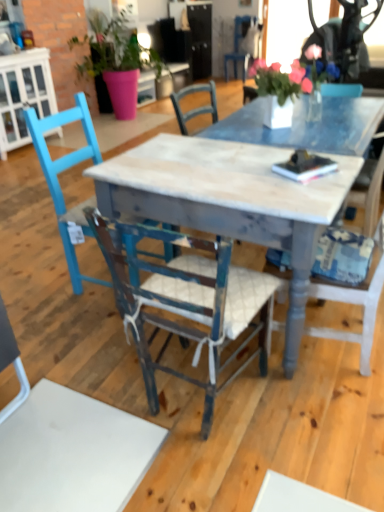
You are a GUI agent. You are given a task and a screenshot of the screen. Output one action in this format:
    pyautogui.click(x=<x>, y=<y>)
    Task: Click on the white fabric chair at center, arranged as the 3th chair when viewed from the back
    This screenshot has height=512, width=384.
    Given the screenshot: What is the action you would take?
    pyautogui.click(x=355, y=301)

What do you see at coordinates (238, 45) in the screenshot?
I see `wooden chair at center, the first chair when ordered from back to front` at bounding box center [238, 45].

The height and width of the screenshot is (512, 384). Describe the element at coordinates (186, 301) in the screenshot. I see `worn wood chair at center, the fourth chair viewed from the top` at that location.

Locate an element on the screen. The width and height of the screenshot is (384, 512). matte pink pot at upper left is located at coordinates (115, 59).

Where is `white fabric chair at center, arranged as the 3th chair when viewed from the back`? The width and height of the screenshot is (384, 512). white fabric chair at center, arranged as the 3th chair when viewed from the back is located at coordinates (355, 301).

From a real-world perspective, which object rests below the other?

distressed wood desk at center is physically lower.

Considering the points (355, 122) and (247, 25), which point is in front, point (355, 122) or point (247, 25)?

The point (355, 122) is more forward.

Are distressed wood desk at center and wooden chair at center, placed as the fourth chair when sorted from bottom to top, making contact?

There is a gap between distressed wood desk at center and wooden chair at center, placed as the fourth chair when sorted from bottom to top.

Does distressed wood desk at center turn towards wooden chair at center, placed as the fourth chair when sorted from bottom to top?

No, distressed wood desk at center does not turn towards wooden chair at center, placed as the fourth chair when sorted from bottom to top.

Is matte pink pot at upper left turned away from white glossy cabinet at left?

That's not correct — matte pink pot at upper left is not looking away from white glossy cabinet at left.

From the image's perspective, which object appears higher, matte pink pot at upper left or white glossy cabinet at left?

matte pink pot at upper left, from the image's perspective.

Consider the image. From a real-world perspective, is matte pink pot at upper left on top of white glossy cabinet at left?

Yes, from a real-world perspective, matte pink pot at upper left is over white glossy cabinet at left

Considering the points (94, 72) and (14, 139), which point is behind, point (94, 72) or point (14, 139)?

Point (94, 72)

From the image's perspective, which one is positioned higher, worn wood chair at center, the fourth chair viewed from the top, or matte pink pot at upper left?

matte pink pot at upper left, from the image's perspective.

Is worn wood chair at center, the fourth chair viewed from the top, touching matte pink pot at upper left?

No, worn wood chair at center, the fourth chair viewed from the top, is not touching matte pink pot at upper left.

How distant is worn wood chair at center, the fourth chair viewed from the top, from matte pink pot at upper left?

worn wood chair at center, the fourth chair viewed from the top, and matte pink pot at upper left are 4.72 meters apart from each other.

In the image, is worn wood chair at center, arranged as the 4th chair when viewed from the back, positioned in front of or behind matte pink pot at upper left?

Visually, worn wood chair at center, arranged as the 4th chair when viewed from the back, is located in front of matte pink pot at upper left.

Is point (99, 56) closer to camera compared to point (346, 104)?

No, (99, 56) is behind (346, 104).

Is matte pink pot at upper left shorter than distressed wood desk at center?

No, matte pink pot at upper left is not shorter than distressed wood desk at center.

Which of these two, matte pink pot at upper left or distressed wood desk at center, is bigger?

matte pink pot at upper left.

How distant is white glossy cabinet at left from matte pink pot at upper left?

white glossy cabinet at left and matte pink pot at upper left are 3.72 feet apart.

Is white glossy cabinet at left far from matte pink pot at upper left?

Yes, white glossy cabinet at left and matte pink pot at upper left are quite far apart.

From a real-world perspective, which object rests below the other?

In real-world perspective, white glossy cabinet at left is lower.

Is white glossy cabinet at left located outside matte pink pot at upper left?

white glossy cabinet at left lies outside matte pink pot at upper left's area.

Who is more distant, white fabric chair at center, arranged as the 3th chair when viewed from the back, or wooden chair at center, the first chair when ordered from back to front?

wooden chair at center, the first chair when ordered from back to front, is further away from the camera.

At what (x,y) coordinates should I click in order to perform the action: click on chair that is the 2nd object above the white fabric chair at center, arranged as the 3th chair when viewed from the back (from a real-world perspective). Please return your answer as a coordinate pair (x, y). This screenshot has width=384, height=512. Looking at the image, I should click on (238, 45).

Are white fabric chair at center, the 2th chair positioned from the front, and wooden chair at center, the 4th chair viewed from the front, making contact?

They are not placed beside each other.

From a real-world perspective, relative to wooden chair at center, which is counted as the first chair, starting from the top, is white fabric chair at center, the 3th chair positioned from the top, vertically above or below?

Clearly, from a real-world perspective, white fabric chair at center, the 3th chair positioned from the top, is below wooden chair at center, which is counted as the first chair, starting from the top.

Is worn wood chair at center, acting as the first chair starting from the front, outside of white glossy cabinet at left?

Absolutely, worn wood chair at center, acting as the first chair starting from the front, is external to white glossy cabinet at left.

Where is `the 3rd chair in front of the white glossy cabinet at left`? the 3rd chair in front of the white glossy cabinet at left is located at coordinates (186, 301).

Is worn wood chair at center, acting as the first chair starting from the front, touching white glossy cabinet at left?

No.

How many degrees apart are the facing directions of worn wood chair at center, the fourth chair viewed from the top, and white glossy cabinet at left?

There is a 88.7-degree angle between the facing directions of worn wood chair at center, the fourth chair viewed from the top, and white glossy cabinet at left.

Locate an element on the screen. The height and width of the screenshot is (512, 384). chair that is the 2nd object to the right of the distressed wood desk at center, starting at the anchor is located at coordinates (238, 45).

In the image, there is a matte pink pot at upper left. What are the coordinates of `cabinetry below it (from the image's perspective)` in the screenshot? It's located at (23, 95).

From the image, which object appears to be nearer to white fabric chair at center, the 2th chair positioned from the front, blue painted wood chair at left, which appears as the third chair when ordered from the bottom, or distressed wood desk at center?

distressed wood desk at center is positioned closer to the anchor white fabric chair at center, the 2th chair positioned from the front.

Which object lies nearer to the anchor point blue painted wood chair at left, which appears as the third chair when ordered from the bottom, white glossy cabinet at left or white fabric chair at center, which appears as the second chair when ordered from the bottom?

Among the two, white fabric chair at center, which appears as the second chair when ordered from the bottom, is located nearer to blue painted wood chair at left, which appears as the third chair when ordered from the bottom.

Considering their positions, is white fabric chair at center, the 3th chair positioned from the top, positioned further to distressed wood desk at center than white glossy cabinet at left?

The object further to distressed wood desk at center is white glossy cabinet at left.

Which object lies nearer to the anchor point worn wood chair at center, the fourth chair viewed from the top, wooden chair at center, placed as the fourth chair when sorted from bottom to top, or white glossy cabinet at left?

Based on the image, white glossy cabinet at left appears to be nearer to worn wood chair at center, the fourth chair viewed from the top.

From the image, which object appears to be nearer to white glossy cabinet at left, wooden chair at center, placed as the fourth chair when sorted from bottom to top, or matte pink pot at upper left?

matte pink pot at upper left is positioned closer to the anchor white glossy cabinet at left.

Which object lies further to the anchor point distressed wood desk at center, matte pink pot at upper left or wooden chair at center, placed as the fourth chair when sorted from bottom to top?

Based on the image, wooden chair at center, placed as the fourth chair when sorted from bottom to top, appears to be further to distressed wood desk at center.

Considering their positions, is matte pink pot at upper left positioned closer to distressed wood desk at center than white fabric chair at center, the 3th chair positioned from the top?

white fabric chair at center, the 3th chair positioned from the top, is positioned closer to the anchor distressed wood desk at center.

Looking at the image, which one is located further to worn wood chair at center, arranged as the 4th chair when viewed from the back, matte pink pot at upper left or blue painted wood chair at left, the 2th chair in the back-to-front sequence?

The object further to worn wood chair at center, arranged as the 4th chair when viewed from the back, is matte pink pot at upper left.

You are a GUI agent. You are given a task and a screenshot of the screen. Output one action in this format:
    pyautogui.click(x=<x>, y=<y>)
    Task: Click on the houseplant positioned between distressed wood desk at center and wooden chair at center, placed as the fourth chair when sorted from bottom to top, from near to far
    The image size is (384, 512).
    Given the screenshot: What is the action you would take?
    pyautogui.click(x=115, y=59)

The height and width of the screenshot is (512, 384). In order to click on houseplant between worn wood chair at center, the fourth chair viewed from the top, and wooden chair at center, the 4th chair viewed from the front, in the front-back direction in this screenshot , I will do `click(115, 59)`.

Find the location of a particular element. Image resolution: width=384 pixels, height=512 pixels. cabinetry between distressed wood desk at center and wooden chair at center, which is counted as the first chair, starting from the top, along the z-axis is located at coordinates (23, 95).

You are a GUI agent. You are given a task and a screenshot of the screen. Output one action in this format:
    pyautogui.click(x=<x>, y=<y>)
    Task: Click on the cabinetry between blue painted wood chair at left, which appears as the third chair when ordered from the bottom, and matte pink pot at upper left from front to back
    This screenshot has width=384, height=512.
    Given the screenshot: What is the action you would take?
    pyautogui.click(x=23, y=95)